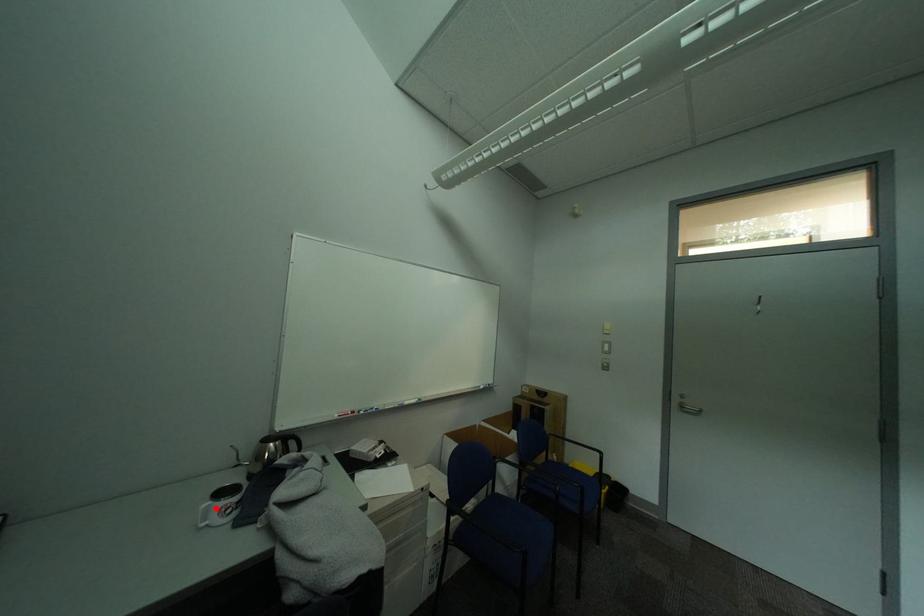
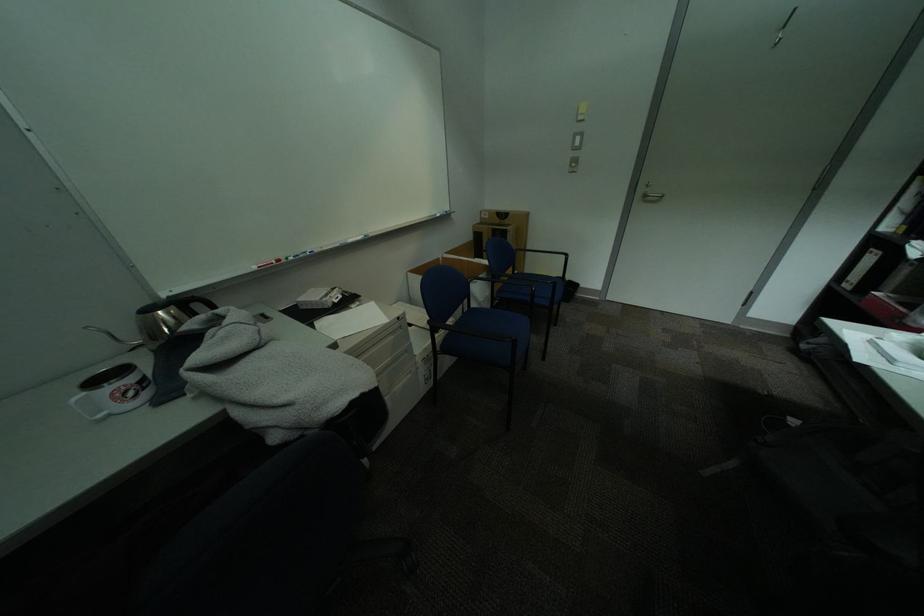
In the second image, find the point that corresponds to the highlighted location in the first image.

(90, 400)